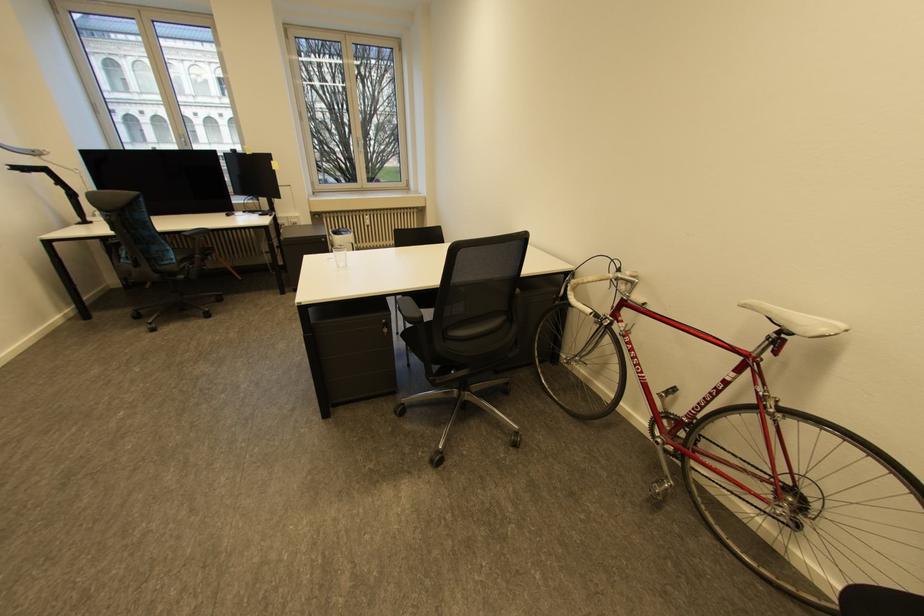
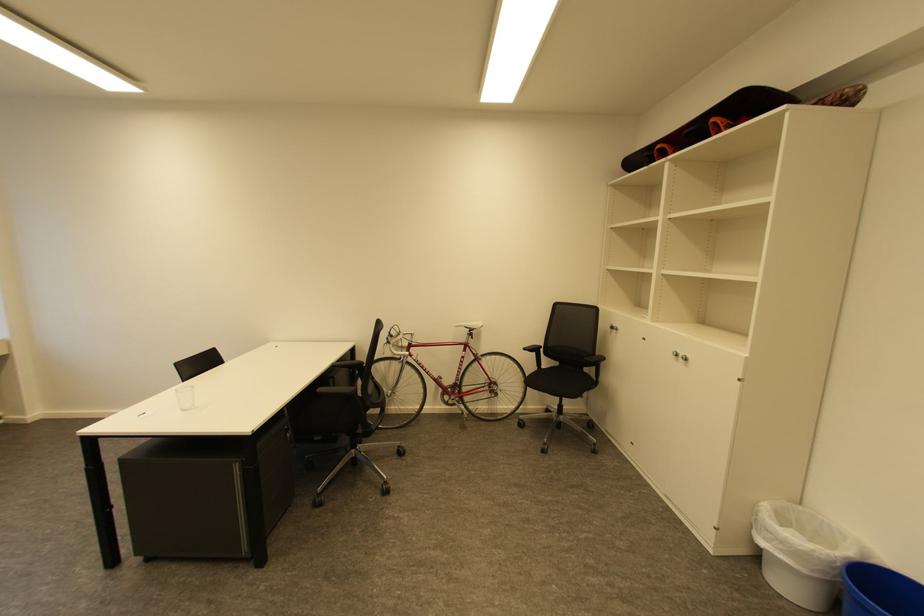
In the second image, find the point that corresponds to (745,371) in the first image.

(471, 351)